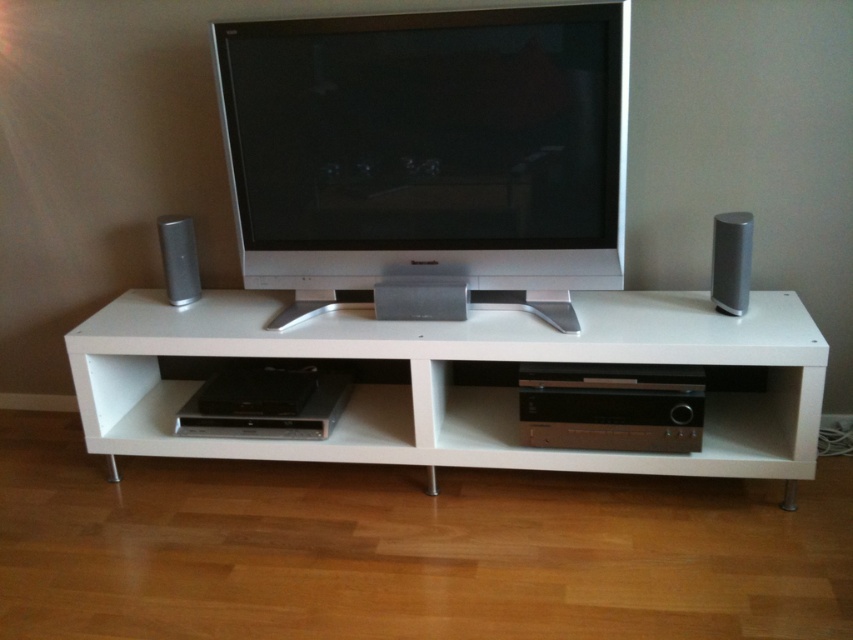
Question: Among these points, which one is farthest from the camera?

Choices:
 (A) (641, 392)
 (B) (431, 291)

Answer: (B)

Question: Where is satin silver flat screen tv at center located in relation to black plastic dvd player at lower center in the image?

Choices:
 (A) above
 (B) below

Answer: (A)

Question: Among these points, which one is farthest from the camera?

Choices:
 (A) (575, 390)
 (B) (206, 390)
 (C) (808, 429)

Answer: (B)

Question: In this image, where is black metallic stereo at lower center located relative to black plastic stereo at lower center?

Choices:
 (A) left
 (B) right

Answer: (B)

Question: Is the position of white matte entertainment center at center less distant than that of black plastic stereo at lower center?

Choices:
 (A) yes
 (B) no

Answer: (A)

Question: Among these objects, which one is farthest from the camera?

Choices:
 (A) satin silver speaker at center
 (B) satin silver speaker at right
 (C) black metallic stereo at lower center

Answer: (A)